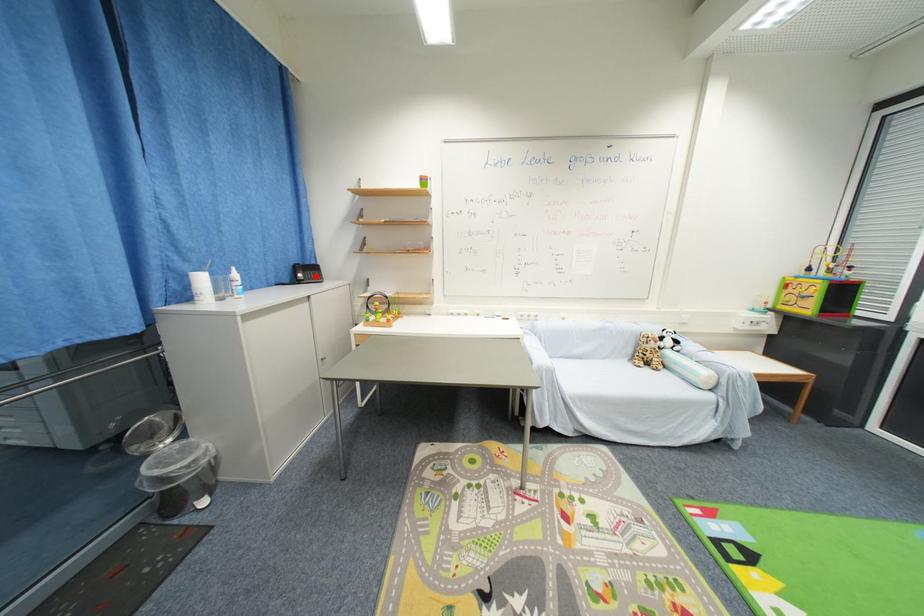
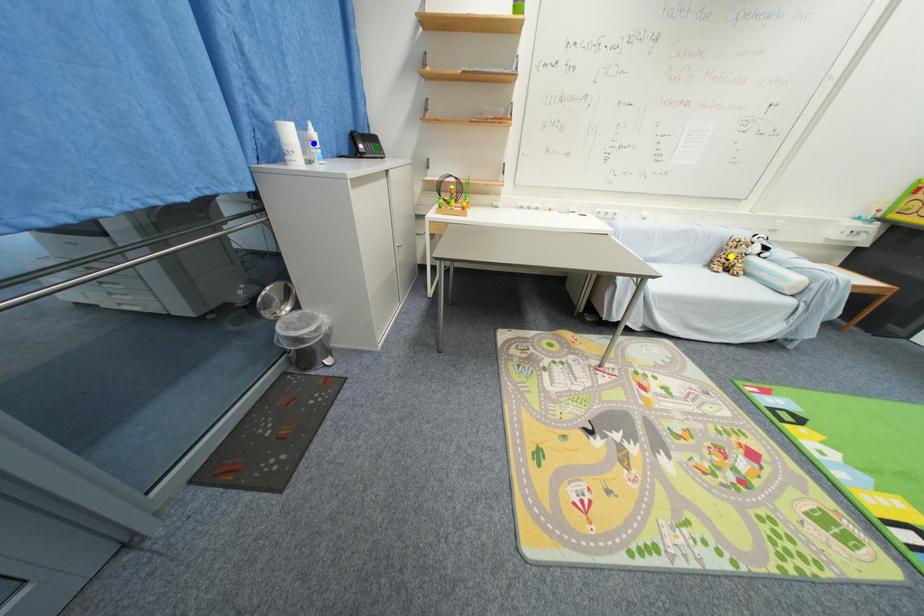
Question: I am providing you with two images of the same scene from different viewpoints. A red point is marked on the first image. You are given multiple points on the second image. Can you choose the point in image 2 that corresponds to the point in image 1?

Choices:
 (A) green point
 (B) blue point
 (C) yellow point

Answer: (A)